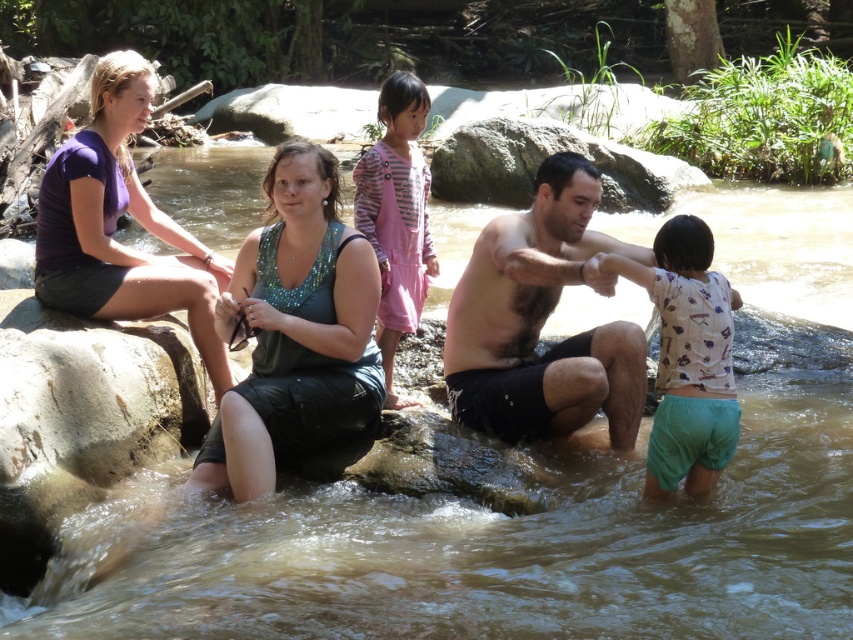
Between green sequined tank top at center and pink cotton dress at center, which one appears on the left side from the viewer's perspective?

green sequined tank top at center

How distant is green sequined tank top at center from pink cotton dress at center?

green sequined tank top at center and pink cotton dress at center are 3.60 feet apart from each other.

Does point (236, 273) come behind point (393, 115)?

No.

You are a GUI agent. You are given a task and a screenshot of the screen. Output one action in this format:
    pyautogui.click(x=<x>, y=<y>)
    Task: Click on the green sequined tank top at center
    The image size is (853, 640).
    Given the screenshot: What is the action you would take?
    294,332

Is dark skin man at center thinner than purple matte shirt at left?

Correct, dark skin man at center's width is less than purple matte shirt at left's.

Between point (497, 284) and point (61, 156), which one is positioned behind?

The point (61, 156) is more distant.

Locate an element on the screen. dark skin man at center is located at coordinates (543, 321).

Which is more to the right, green sequined tank top at center or white printed shirt at lower right?

white printed shirt at lower right

Between point (293, 211) and point (664, 472), which one is positioned behind?

Positioned behind is point (293, 211).

Is point (299, 269) positioned in front of point (618, 260)?

No, (299, 269) is behind (618, 260).

Locate an element on the screen. green sequined tank top at center is located at coordinates (294, 332).